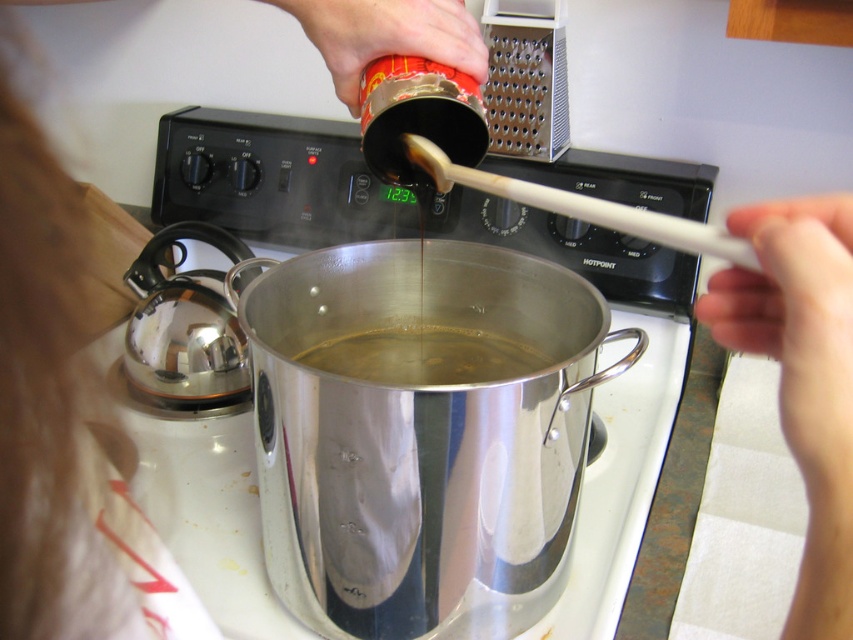
You are a chef trying to locate the white plastic spoon at upper right in the image. Based on the coordinates provided, where would you find it?

The white plastic spoon at upper right is located at the coordinates point (802,376).